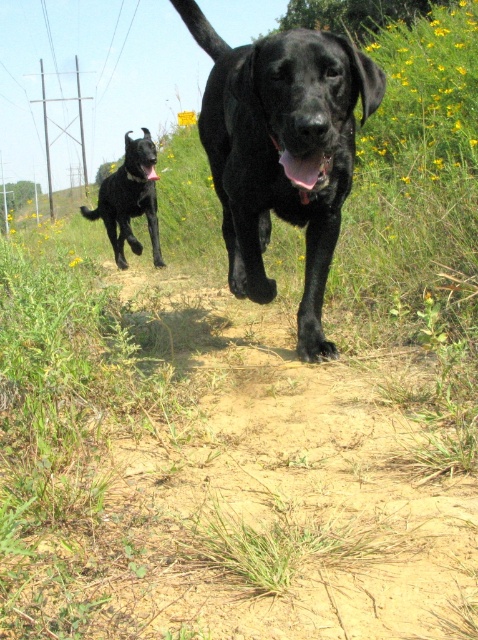
Question: Does shiny black dog at center appear on the right side of shiny black dog at upper left?

Choices:
 (A) yes
 (B) no

Answer: (A)

Question: Which of the following is the farthest from the observer?

Choices:
 (A) (294, 144)
 (B) (150, 164)

Answer: (B)

Question: Does shiny black dog at center have a greater width compared to shiny black dog at upper left?

Choices:
 (A) no
 (B) yes

Answer: (A)

Question: Which of the following is the closest to the observer?

Choices:
 (A) (319, 81)
 (B) (141, 145)

Answer: (A)

Question: Is shiny black dog at center positioned behind shiny black dog at upper left?

Choices:
 (A) yes
 (B) no

Answer: (B)